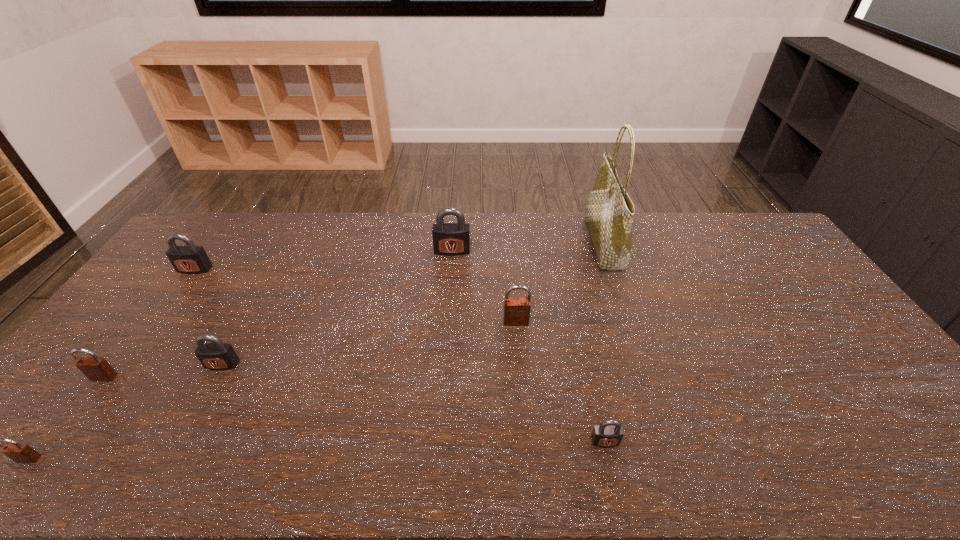
Where is `object that is the fifth nearest to the third nearest gray padlock`? The width and height of the screenshot is (960, 540). object that is the fifth nearest to the third nearest gray padlock is located at coordinates (516, 310).

This screenshot has width=960, height=540. Identify the location of padlock that is the fourth closest one to the rightmost padlock. (96, 369).

Image resolution: width=960 pixels, height=540 pixels. Find the location of `padlock object that ranks as the fourth closest to the seventh shortest object`. padlock object that ranks as the fourth closest to the seventh shortest object is located at coordinates (187, 259).

Where is `the third closest gray padlock to the farthest brown padlock`? the third closest gray padlock to the farthest brown padlock is located at coordinates click(217, 355).

The height and width of the screenshot is (540, 960). In order to click on gray padlock that is the fourth closest to the second padlock from right to left in this screenshot , I will do `click(187, 259)`.

Select which brown padlock is the third closest to the second biggest gray padlock. Please provide its 2D coordinates. Your answer should be formatted as a tuple, i.e. [(x, y)], where the tuple contains the x and y coordinates of a point satisfying the conditions above.

[(516, 310)]

Point out which brown padlock is positioned as the third nearest to the third biggest gray padlock. Please provide its 2D coordinates. Your answer should be formatted as a tuple, i.e. [(x, y)], where the tuple contains the x and y coordinates of a point satisfying the conditions above.

[(516, 310)]